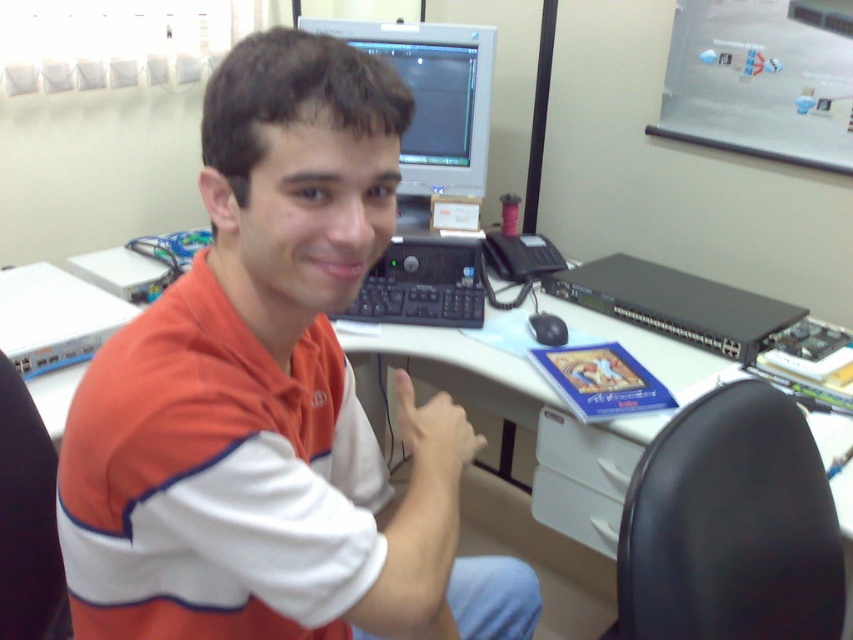
Question: Which of the following is the closest to the observer?

Choices:
 (A) orange cotton polo shirt at upper left
 (B) black fabric chair at lower left
 (C) matte black monitor at upper center
 (D) matte silver monitor at upper center

Answer: (A)

Question: Does orange cotton shirt at center have a lesser width compared to matte silver monitor at upper center?

Choices:
 (A) no
 (B) yes

Answer: (A)

Question: Among these points, which one is nearest to the camera?

Choices:
 (A) (410, 80)
 (B) (421, 464)

Answer: (B)

Question: Which of these objects is positioned farthest from the orange cotton shirt at center?

Choices:
 (A) matte black monitor at upper center
 (B) orange cotton polo shirt at upper left
 (C) matte silver monitor at upper center

Answer: (A)

Question: Does matte silver monitor at upper center lie behind matte black monitor at upper center?

Choices:
 (A) yes
 (B) no

Answer: (B)

Question: Does orange cotton shirt at center have a smaller size compared to black fabric chair at lower left?

Choices:
 (A) no
 (B) yes

Answer: (A)